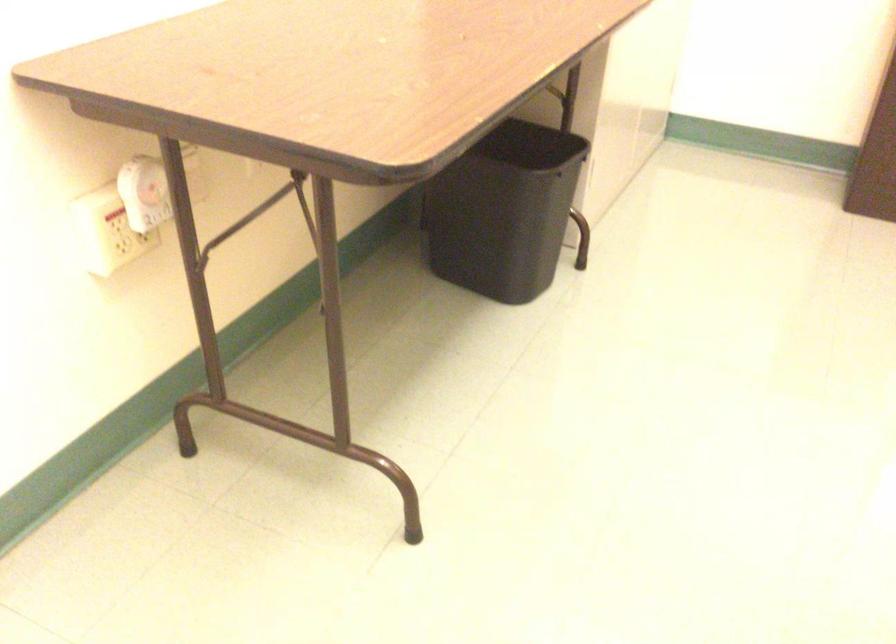
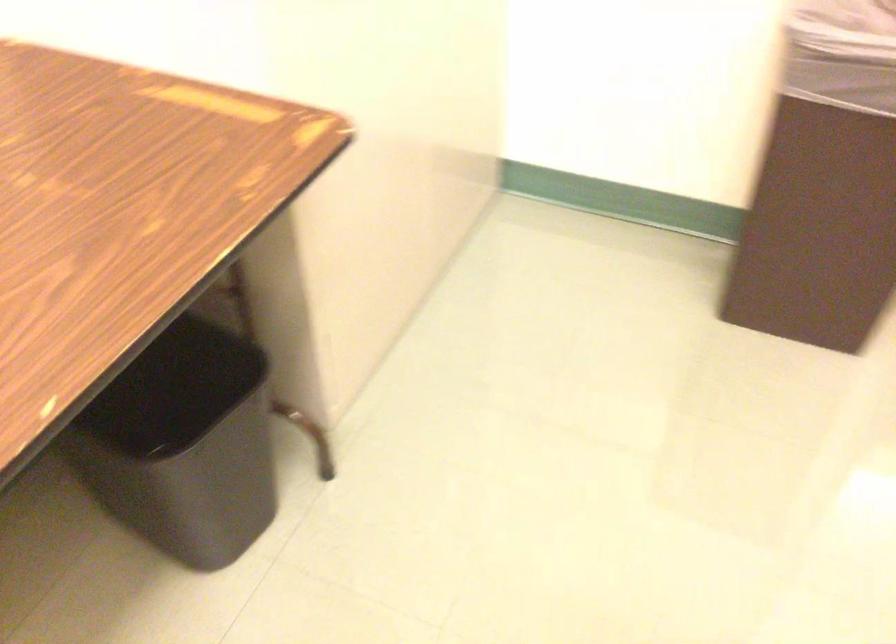
Question: The images are taken continuously from a first-person perspective. In which direction is your viewpoint rotating?

Choices:
 (A) Left
 (B) Right
 (C) Up
 (D) Down

Answer: (D)